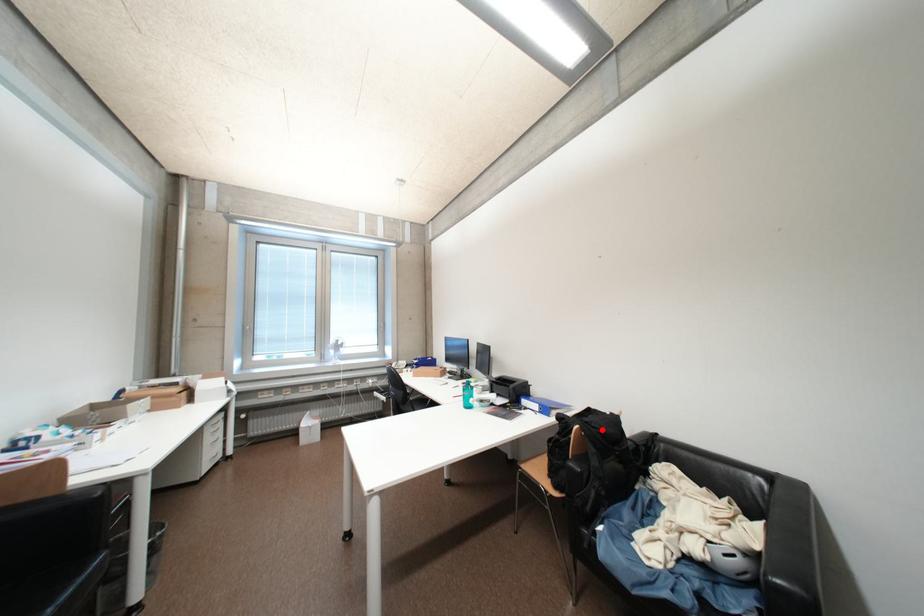
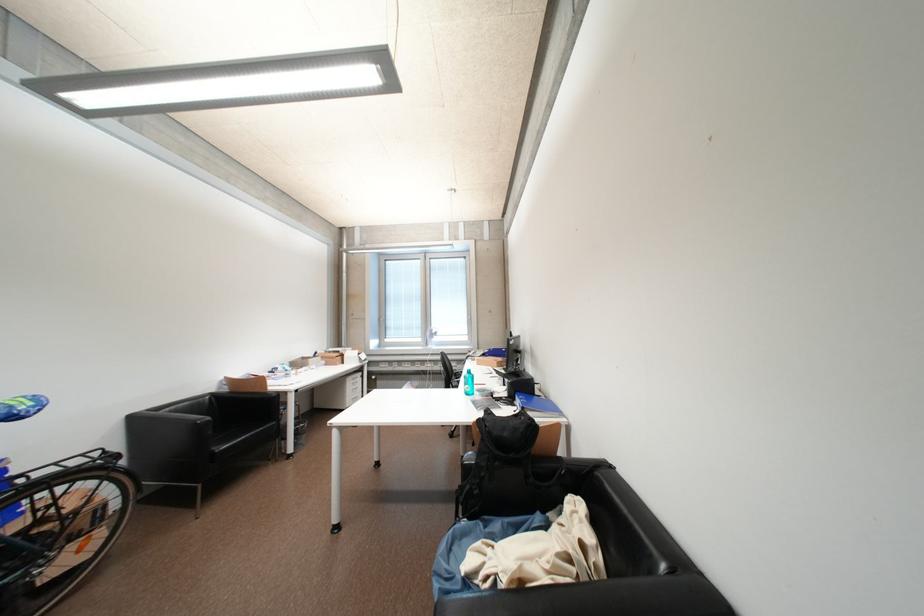
Where in the second image is the point corresponding to the highlighted location from the first image?

(493, 428)